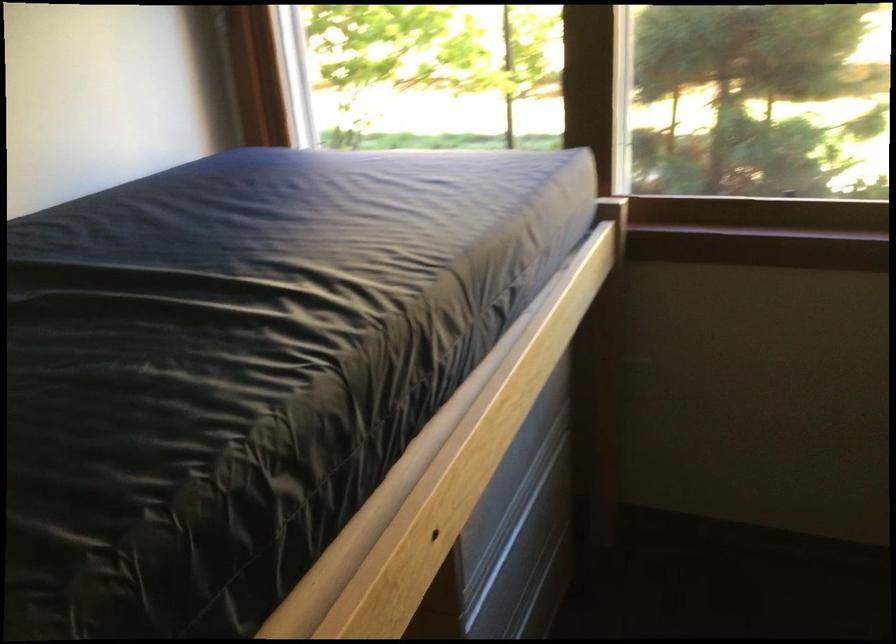
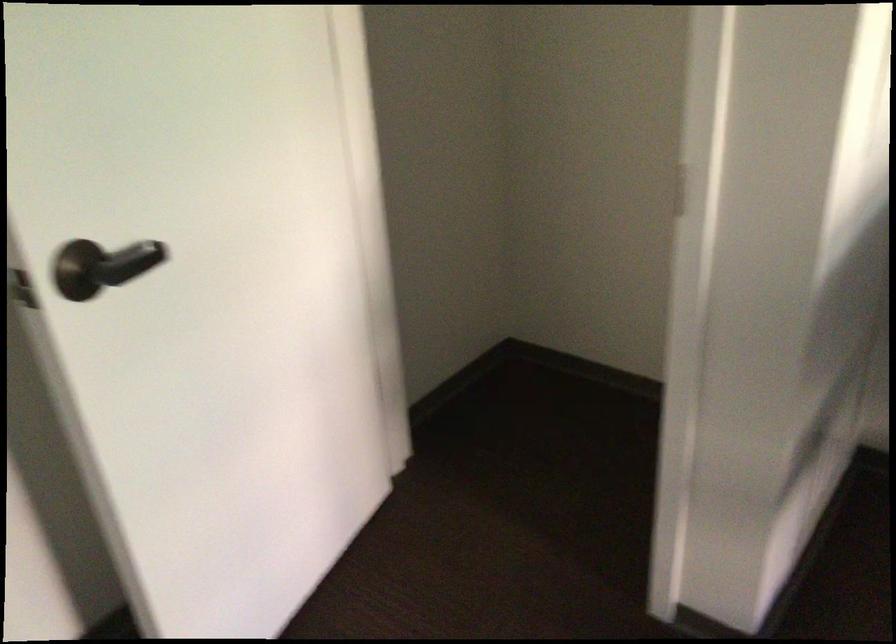
The images are taken continuously from a first-person perspective. In which direction is your viewpoint rotating?

The rotation direction of the camera is left-down.